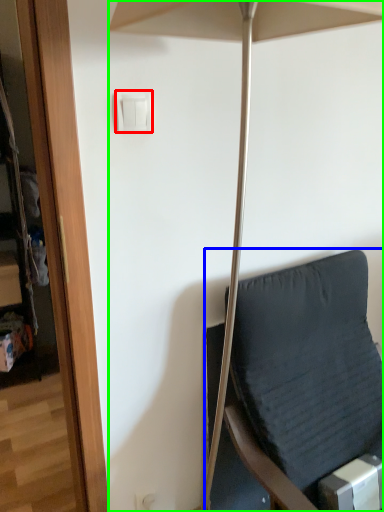
Question: Based on their relative distances, which object is farther from light switch (highlighted by a red box)? Choose from furniture (highlighted by a blue box) and umbrella (highlighted by a green box).

Choices:
 (A) furniture
 (B) umbrella

Answer: (A)